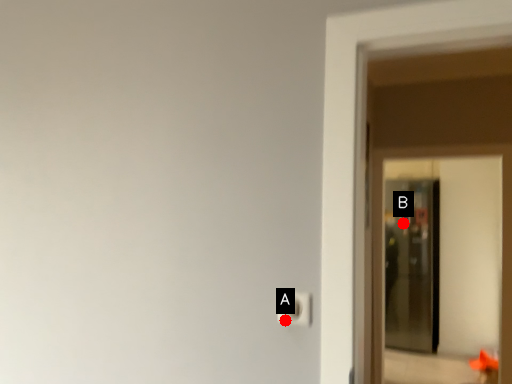
Question: Two points are circled on the image, labeled by A and B beside each circle. Which point appears closest to the camera in this image?

Choices:
 (A) A is closer
 (B) B is closer

Answer: (A)